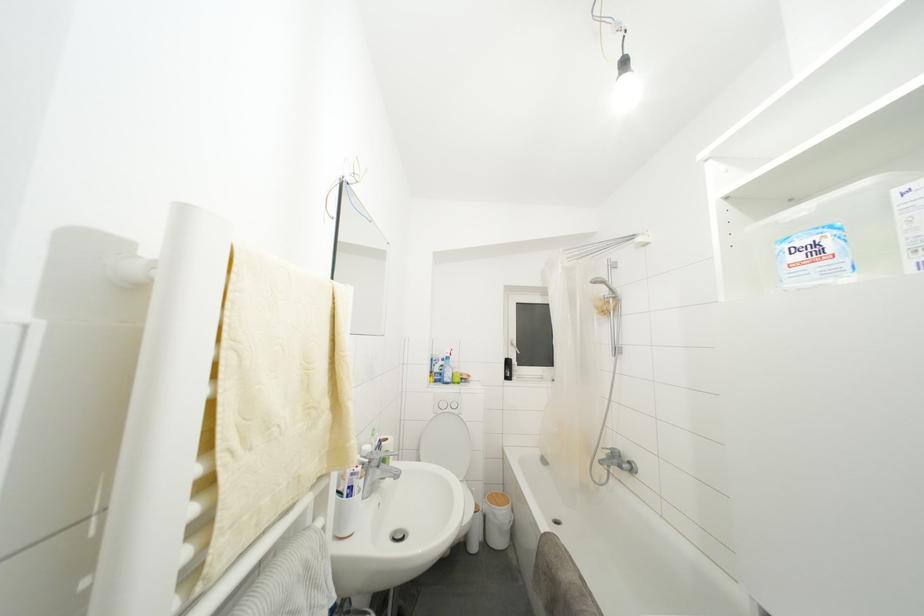
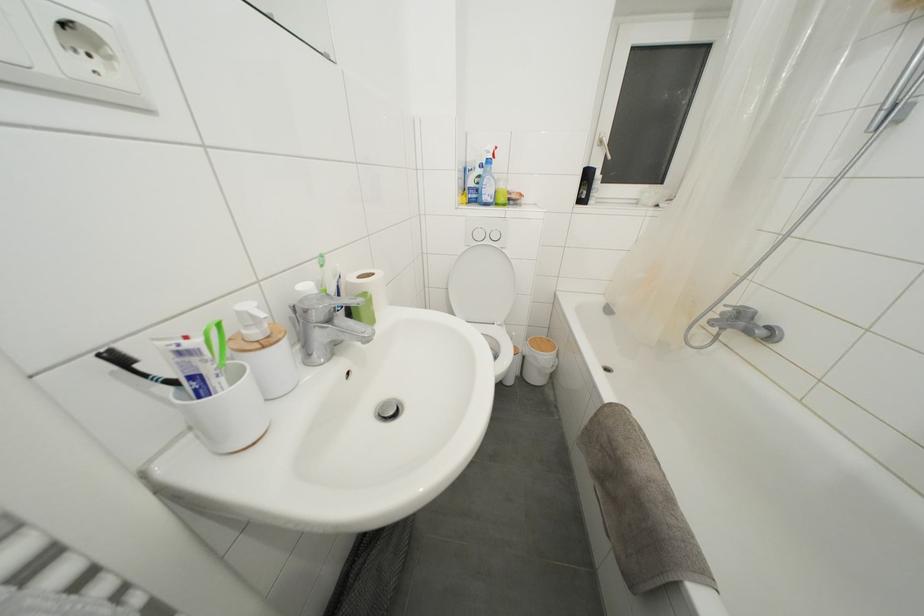
The point at (357, 479) is marked in the first image. Where is the corresponding point in the second image?

(185, 358)